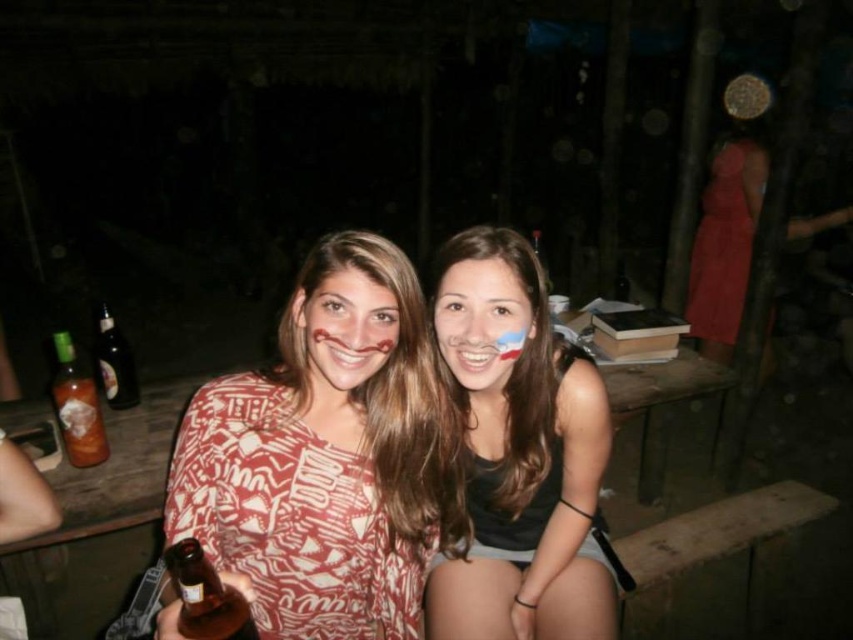
Who is lower down, matte red dress at center or matte skin face at center?

matte red dress at center is lower down.

Does matte red dress at center appear under matte skin face at center?

Yes.

Who is more distant from viewer, [196,481] or [491,380]?

The point [491,380] is more distant.

This screenshot has height=640, width=853. I want to click on matte red dress at center, so click(326, 454).

Is translucent glass bottle at lower left shorter than dark glass bottle at left?

No.

Is translucent glass bottle at lower left taller than dark glass bottle at left?

Yes.

I want to click on translucent glass bottle at lower left, so click(x=76, y=406).

Is matte red face at center thinner than brown glass bottle at lower left?

In fact, matte red face at center might be wider than brown glass bottle at lower left.

Which is in front, point (374, 372) or point (189, 618)?

Positioned in front is point (189, 618).

Does point (390, 344) lie in front of point (183, 541)?

No.

The width and height of the screenshot is (853, 640). I want to click on matte red face at center, so click(345, 330).